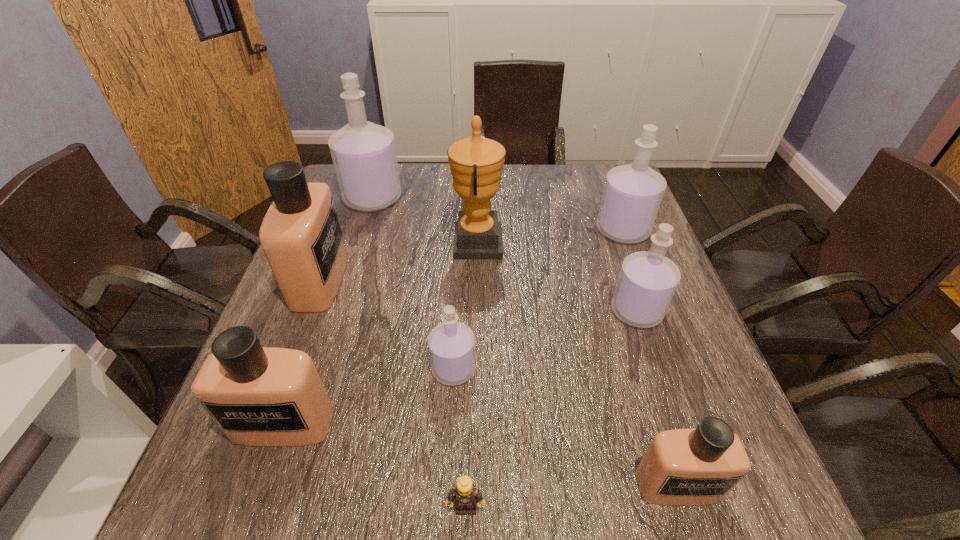
This screenshot has height=540, width=960. In order to click on vacant area that lies between the biggest beige perfume and the smallest purple perfume in this screenshot , I will do `click(387, 325)`.

You are a GUI agent. You are given a task and a screenshot of the screen. Output one action in this format:
    pyautogui.click(x=<x>, y=<y>)
    Task: Click on the free spot between the smallest beige perfume and the second smallest beige perfume
    The image size is (960, 540).
    Given the screenshot: What is the action you would take?
    pyautogui.click(x=480, y=455)

This screenshot has height=540, width=960. In order to click on vacant point located between the award and the smallest beige perfume in this screenshot , I will do `click(577, 364)`.

I want to click on empty space that is in between the biggest beige perfume and the Lego, so click(x=393, y=394).

Where is `blank region between the farthest beige perfume and the tallest perfume`? Image resolution: width=960 pixels, height=540 pixels. blank region between the farthest beige perfume and the tallest perfume is located at coordinates (347, 239).

This screenshot has height=540, width=960. Find the location of `free space that is in between the second nearest purple perfume and the biggest purple perfume`. free space that is in between the second nearest purple perfume and the biggest purple perfume is located at coordinates (505, 254).

I want to click on free space between the second biggest purple perfume and the golden award, so click(x=550, y=237).

Where is `vacant area between the Lego and the fourth perfume from right to left`? Image resolution: width=960 pixels, height=540 pixels. vacant area between the Lego and the fourth perfume from right to left is located at coordinates (x=460, y=438).

Locate an element on the screen. object identified as the eighth closest to the nearest beige perfume is located at coordinates (363, 153).

Image resolution: width=960 pixels, height=540 pixels. Identify the location of object that stands as the seventh closest to the tallest perfume. (466, 496).